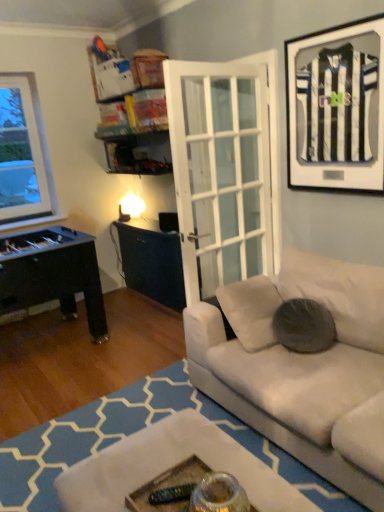
Locate an element on the screen. free space above matte black jersey at upper right (from a real-world perspective) is located at coordinates (331, 24).